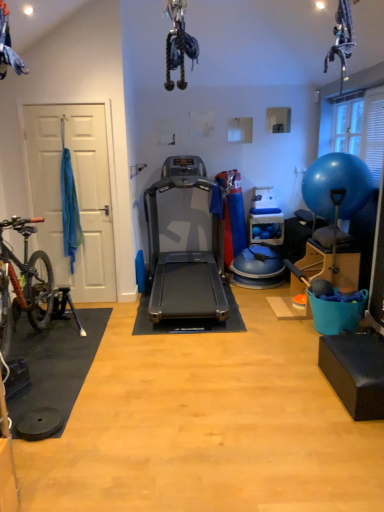
Question: Is silver metallic treadmill at center oriented away from transparent plastic window screen at upper right?

Choices:
 (A) no
 (B) yes

Answer: (A)

Question: From a real-world perspective, is silver metallic treadmill at center under transparent plastic window screen at upper right?

Choices:
 (A) no
 (B) yes

Answer: (B)

Question: Is silver metallic treadmill at center positioned beyond the bounds of transparent plastic window screen at upper right?

Choices:
 (A) yes
 (B) no

Answer: (A)

Question: Can you confirm if silver metallic treadmill at center is bigger than transparent plastic window screen at upper right?

Choices:
 (A) no
 (B) yes

Answer: (B)

Question: Is silver metallic treadmill at center to the right of transparent plastic window screen at upper right from the viewer's perspective?

Choices:
 (A) yes
 (B) no

Answer: (B)

Question: Does silver metallic treadmill at center have a greater width compared to transparent plastic window screen at upper right?

Choices:
 (A) yes
 (B) no

Answer: (A)

Question: Is transparent plastic window screen at upper right positioned before silver metallic treadmill at center?

Choices:
 (A) yes
 (B) no

Answer: (B)

Question: Is transparent plastic window screen at upper right shorter than silver metallic treadmill at center?

Choices:
 (A) no
 (B) yes

Answer: (B)

Question: Can you confirm if transparent plastic window screen at upper right is positioned to the right of silver metallic treadmill at center?

Choices:
 (A) yes
 (B) no

Answer: (A)

Question: From the image's perspective, is transparent plastic window screen at upper right above silver metallic treadmill at center?

Choices:
 (A) yes
 (B) no

Answer: (A)

Question: From the image's perspective, is transparent plastic window screen at upper right below silver metallic treadmill at center?

Choices:
 (A) no
 (B) yes

Answer: (A)

Question: Does transparent plastic window screen at upper right have a greater width compared to silver metallic treadmill at center?

Choices:
 (A) yes
 (B) no

Answer: (B)

Question: Is silver metallic treadmill at center turned away from blue rubber ball at right?

Choices:
 (A) no
 (B) yes

Answer: (A)